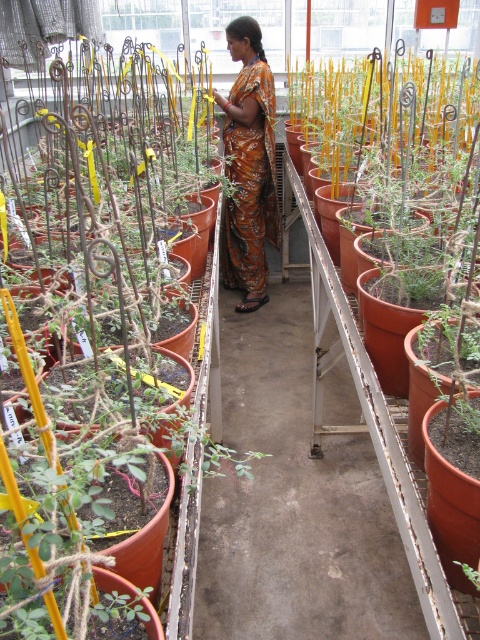
Can you confirm if matte brown pot at center is smaller than orange printed sari at center?

No.

How distant is matte brown pot at center from orange printed sari at center?

matte brown pot at center and orange printed sari at center are 1.81 meters apart from each other.

Describe the element at coordinates (93, 365) in the screenshot. Image resolution: width=480 pixels, height=640 pixels. I see `matte brown pot at center` at that location.

The height and width of the screenshot is (640, 480). I want to click on matte brown pot at center, so point(93,365).

Image resolution: width=480 pixels, height=640 pixels. Describe the element at coordinates (405, 164) in the screenshot. I see `matte orange pot at center-right` at that location.

Can you confirm if matte orange pot at center-right is smaller than orange printed sari at center?

No.

Who is more forward, (439, 257) or (231, 284)?

Point (439, 257)

At what (x,y) coordinates should I click in order to perform the action: click on matte orange pot at center-right. Please return your answer as a coordinate pair (x, y). The width and height of the screenshot is (480, 640). Looking at the image, I should click on (405, 164).

Is point (90, 346) farther from viewer compared to point (351, 84)?

No.

Does point (26, 312) lie behind point (314, 404)?

No, (26, 312) is in front of (314, 404).

Locate an element on the screen. This screenshot has width=480, height=640. matte brown pot at center is located at coordinates (93, 365).